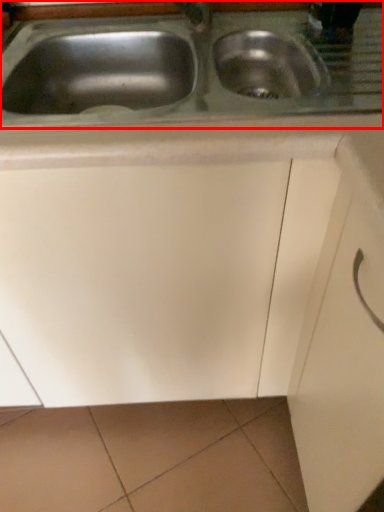
Question: From the image's perspective, where is sink (annotated by the red box) located in relation to drawer in the image?

Choices:
 (A) above
 (B) below

Answer: (A)